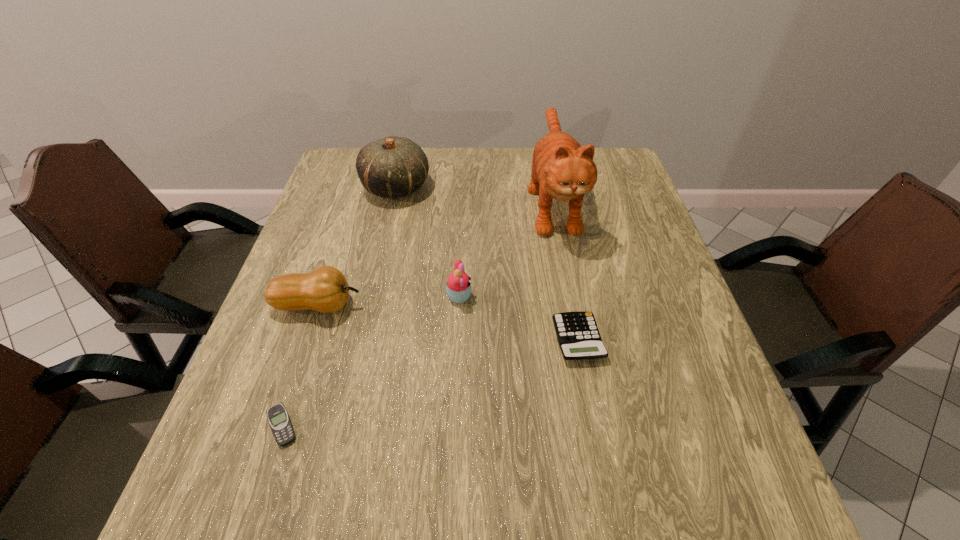
This screenshot has width=960, height=540. I want to click on cat, so click(x=561, y=169).

Image resolution: width=960 pixels, height=540 pixels. What are the coordinates of `the second tallest object` in the screenshot? It's located at (392, 167).

Locate an element on the screen. The image size is (960, 540). the taller gourd is located at coordinates (392, 167).

The width and height of the screenshot is (960, 540). Find the location of `the shorter gourd`. the shorter gourd is located at coordinates (325, 289).

Locate an element on the screen. This screenshot has height=540, width=960. the third object from right to left is located at coordinates (458, 289).

The width and height of the screenshot is (960, 540). What are the coordinates of `calculator` in the screenshot? It's located at (578, 336).

At what (x,y) coordinates should I click in order to perform the action: click on the shortest object. Please return your answer as a coordinate pair (x, y). Looking at the image, I should click on (280, 423).

Where is `beeper`? The width and height of the screenshot is (960, 540). beeper is located at coordinates (280, 423).

This screenshot has height=540, width=960. Find the location of `free space located on the face of the cat`. free space located on the face of the cat is located at coordinates (568, 280).

What are the coordinates of `vacant space located 0.320m on the front of the farther gourd` in the screenshot? It's located at (372, 296).